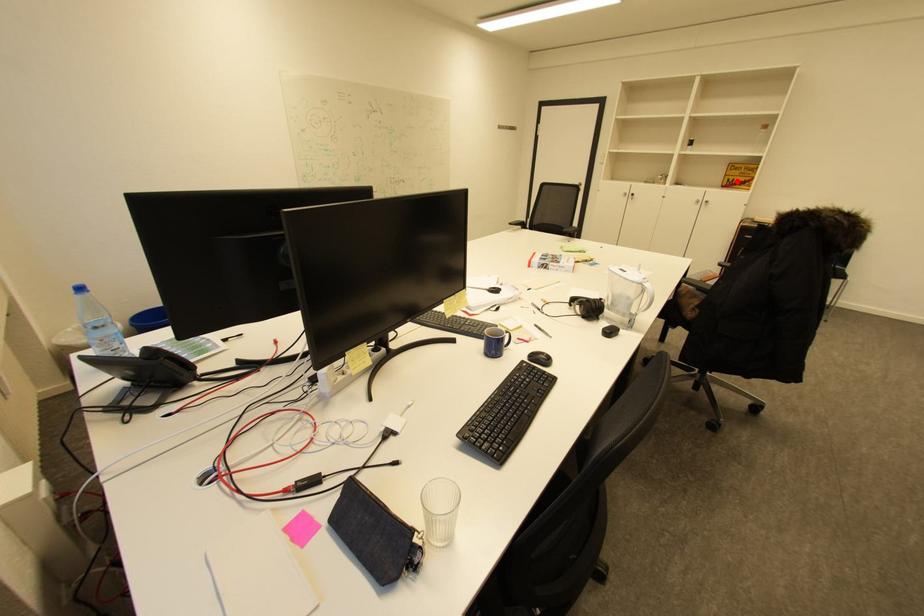
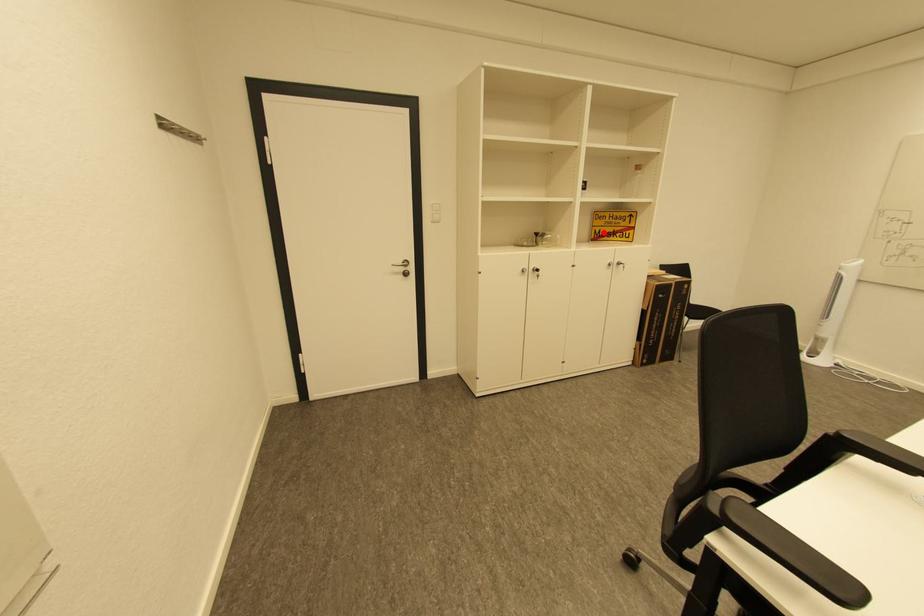
I am providing you with two images of the same scene from different viewpoints. A red point is marked on the first image and another point is marked on the second image. Are the points marked in image1 and image2 representing the same 3D position?

Yes